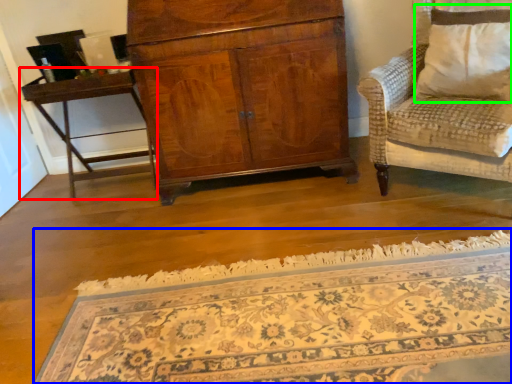
Question: Estimate the real-world distances between objects in this image. Which object is closer to table (highlighted by a red box), mat (highlighted by a blue box) or pillow (highlighted by a green box)?

Choices:
 (A) mat
 (B) pillow

Answer: (A)